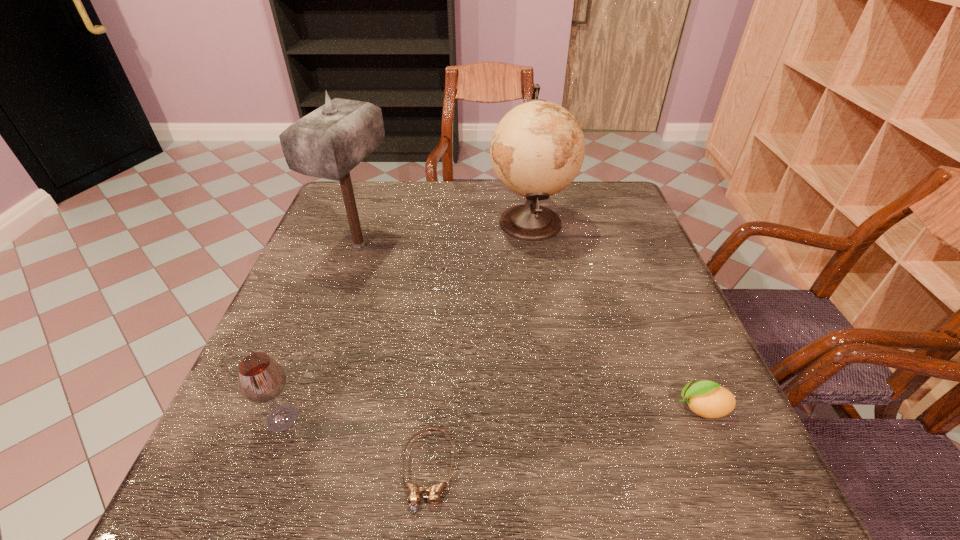
Identify the location of vacant space located 0.050m on the front-facing side of the second object from right to left. The height and width of the screenshot is (540, 960). (470, 222).

At what (x,y) coordinates should I click in order to perform the action: click on free region located on the front-facing side of the second object from right to left. Please return your answer as a coordinate pair (x, y). The width and height of the screenshot is (960, 540). Looking at the image, I should click on (397, 222).

What are the coordinates of `vacant space positioned 0.350m on the back of the wineglass` in the screenshot? It's located at (337, 274).

The image size is (960, 540). What are the coordinates of `vacant area situated 0.230m with leaves positioned above the second shortest object` in the screenshot? It's located at (543, 408).

Locate an element on the screen. vacant space located 0.070m with leaves positioned above the second shortest object is located at coordinates (635, 408).

You are a GUI agent. You are given a task and a screenshot of the screen. Output one action in this format:
    pyautogui.click(x=<x>, y=<y>)
    Task: Click on the vacant space positioned with leaves positioned above the second shortest object
    This screenshot has width=960, height=540.
    Given the screenshot: What is the action you would take?
    pyautogui.click(x=594, y=408)

Find the location of a particular element. mallet that is positioned at the far edge is located at coordinates (329, 142).

I want to click on globe that is at the far edge, so click(537, 149).

The height and width of the screenshot is (540, 960). In order to click on object present at the near edge in this screenshot , I will do `click(415, 492)`.

The height and width of the screenshot is (540, 960). I want to click on mallet at the left edge, so click(x=329, y=142).